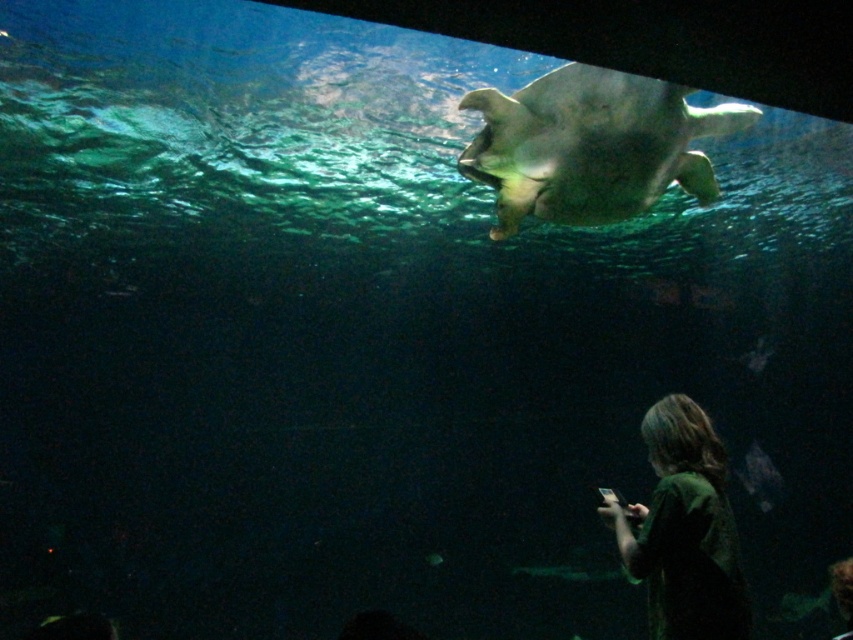
Based on the photo, does smooth gray turtle at upper center appear on the right side of dark green shirt at lower right?

No, smooth gray turtle at upper center is not to the right of dark green shirt at lower right.

Where is `smooth gray turtle at upper center`? This screenshot has height=640, width=853. smooth gray turtle at upper center is located at coordinates (590, 145).

The height and width of the screenshot is (640, 853). Identify the location of smooth gray turtle at upper center. (590, 145).